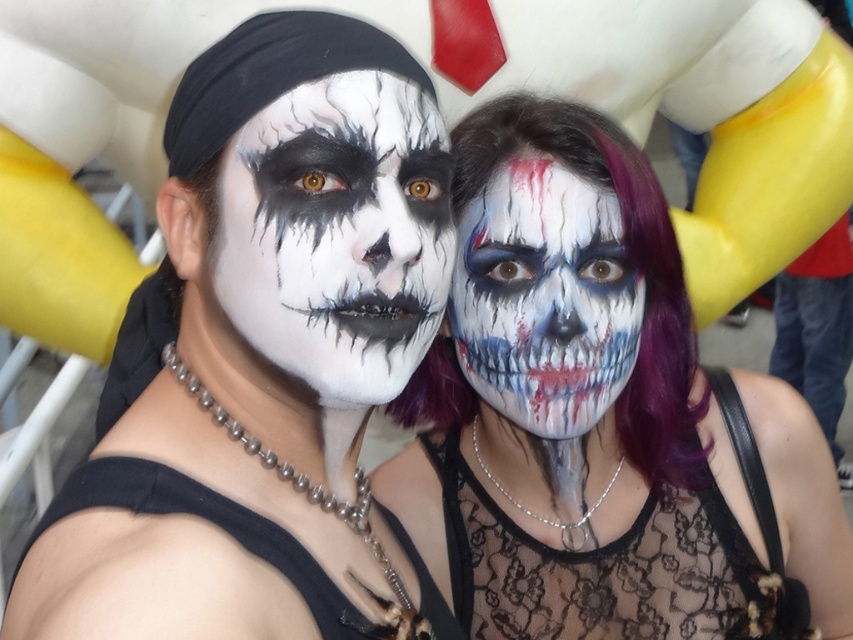
Question: Which point is closer to the camera taking this photo?

Choices:
 (A) (607, 308)
 (B) (345, 180)

Answer: (B)

Question: Where is blood-stained lace dress at center located in relation to matte white skull at center in the image?

Choices:
 (A) right
 (B) left

Answer: (A)

Question: Which point is farther to the camera?

Choices:
 (A) blood-stained lace dress at center
 (B) matte black face paint at center
 (C) matte black skull at center

Answer: (A)

Question: Where is matte black face paint at center located in relation to matte black skull at center in the image?

Choices:
 (A) left
 (B) right

Answer: (A)

Question: Is the position of blood-stained lace dress at center less distant than that of matte white skull at center?

Choices:
 (A) no
 (B) yes

Answer: (A)

Question: Which point is farther to the camera?

Choices:
 (A) (718, 488)
 (B) (592, 371)
 (C) (334, 380)
 (D) (340, 284)

Answer: (A)